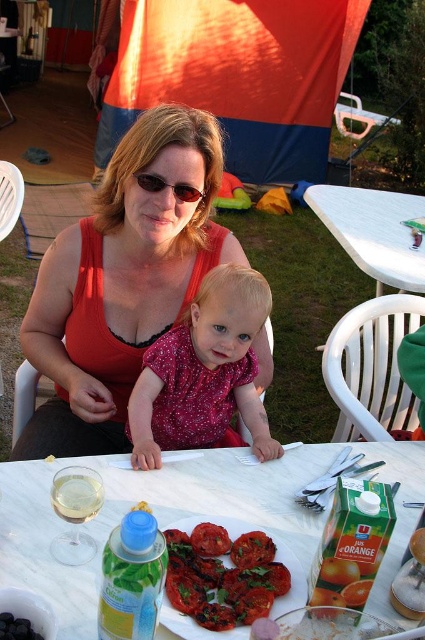
Question: Based on their relative distances, which object is nearer to the matte red tank top at center?

Choices:
 (A) white plastic table at center
 (B) tomatojuicy fleshat lower center

Answer: (B)

Question: Which point is farther to the camera?

Choices:
 (A) green plastic bottle at table center
 (B) tomato at center
 (C) brown plastic sunglasses at center
 (D) shiny red tomato at center

Answer: (C)

Question: Does white plastic table at center lie behind green plastic bottle at table center?

Choices:
 (A) no
 (B) yes

Answer: (B)

Question: Can you confirm if pink sparkly dress at center is thinner than brown plastic sunglasses at center?

Choices:
 (A) yes
 (B) no

Answer: (B)

Question: Considering the real-world distances, which object is farthest from the white marble table at center?

Choices:
 (A) matte red tank top at center
 (B) white plastic table at center
 (C) tomatojuicy fleshat lower center

Answer: (B)

Question: Is white marble table at center smaller than brown plastic sunglasses at center?

Choices:
 (A) yes
 (B) no

Answer: (B)